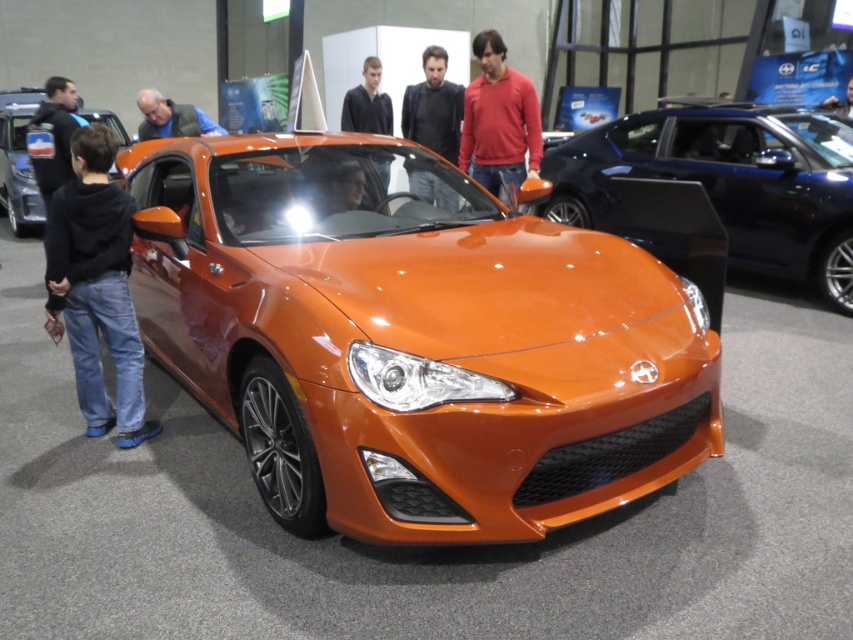
Question: Does black hoodie at left appear on the right side of matte red sweater at center?

Choices:
 (A) no
 (B) yes

Answer: (A)

Question: Does shiny metallic car at left have a lesser width compared to matte black car at center?

Choices:
 (A) yes
 (B) no

Answer: (B)

Question: Which is nearer to the shiny metallic car at left?

Choices:
 (A) matte black shirt at upper center
 (B) matte red sweater at center

Answer: (A)

Question: Is shiny metallic car at left wider than matte black car at center?

Choices:
 (A) no
 (B) yes

Answer: (B)

Question: Which object is the farthest from the matte black jacket at left?

Choices:
 (A) matte blue shirt at upper left
 (B) shiny orange sports car at center
 (C) dark brown leather jacket at center
 (D) black hoodie at left

Answer: (B)

Question: Which point is closer to the camera taking this photo?

Choices:
 (A) (500, 148)
 (B) (45, 189)
 (C) (96, 422)
 (D) (434, 76)

Answer: (C)